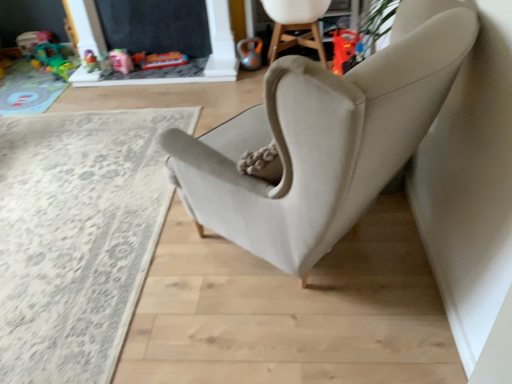
This screenshot has height=384, width=512. I want to click on free point above plastic pink toy at upper left, placed as the 5th toy when sorted from right to left (from a real-world perspective), so click(x=35, y=28).